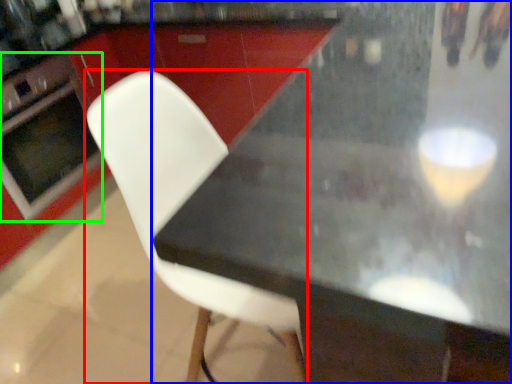
Question: Considering the real-world distances, which object is closest to chair (highlighted by a red box)? table (highlighted by a blue box) or oven (highlighted by a green box).

Choices:
 (A) table
 (B) oven

Answer: (A)